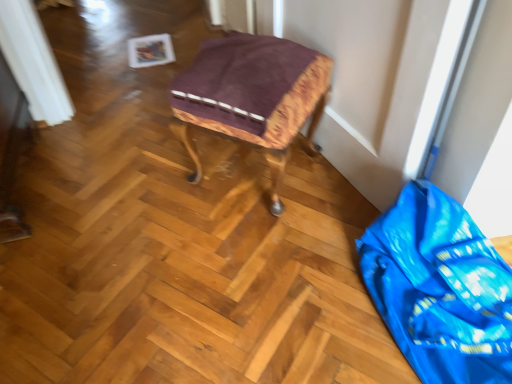
Where is `vacant space that is in between wooden stool at center and blue shiny plastic bag at lower right`? vacant space that is in between wooden stool at center and blue shiny plastic bag at lower right is located at coordinates (311, 243).